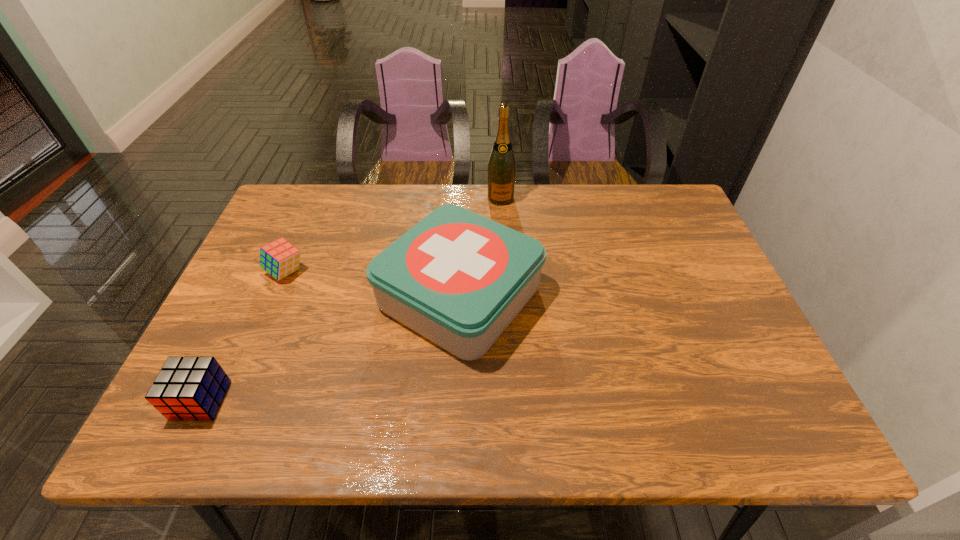
Locate an element on the screen. empty space between the farther cube and the farthest object is located at coordinates (394, 235).

You are a GUI agent. You are given a task and a screenshot of the screen. Output one action in this format:
    pyautogui.click(x=<x>, y=<y>)
    Task: Click on the vacant area between the third shortest object and the nearer cube
    
    Given the screenshot: What is the action you would take?
    pyautogui.click(x=330, y=348)

Choose which object is the second nearest neighbor to the second tallest object. Please provide its 2D coordinates. Your answer should be formatted as a tuple, i.e. [(x, y)], where the tuple contains the x and y coordinates of a point satisfying the conditions above.

[(280, 258)]

The height and width of the screenshot is (540, 960). Find the location of `object that is the second closest to the third shortest object`. object that is the second closest to the third shortest object is located at coordinates (280, 258).

Identify the location of free space that satisfies the following two spatial constraints: 1. on the back side of the nearest object; 2. on the left side of the first-aid kit. (252, 296).